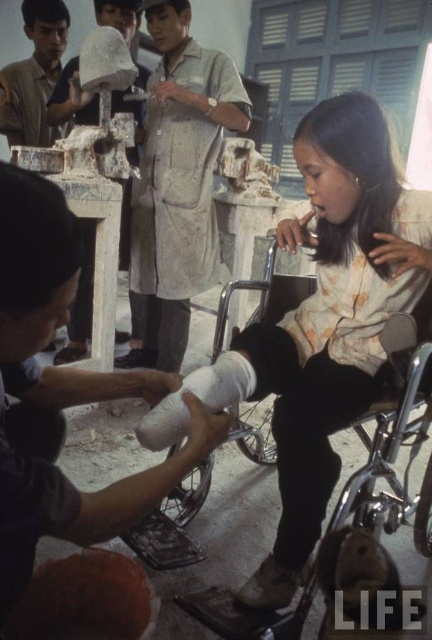
Based on the scene description, where is the silver metallic wheelchair at lower center located in terms of its 2D coordinates?

The silver metallic wheelchair at lower center is located at the 2D coordinates of point [388,435].

You are a physical therapist trying to move the silver metallic wheelchair at lower center into a storage area that is only 2 meters wide. Can you fit the wheelchair through the doorway if the white matte plaster bandage at lower center is placed next to it?

The silver metallic wheelchair at lower center might be wider than the white matte plaster bandage at lower center, so there is a possibility that the wheelchair may not fit through the 2 meter wide doorway when placed next to the bandage. It depends on their exact widths.

You are navigating a tight space in the workshop. You need to move from your current position to the point at coordinates point (256, 636). There is an obstacle at point (178, 435). Can you go around the obstacle to reach your destination?

Point (256, 636) is behind point (178, 435), so you can go around the obstacle at point (178, 435) to reach the destination point (256, 636).